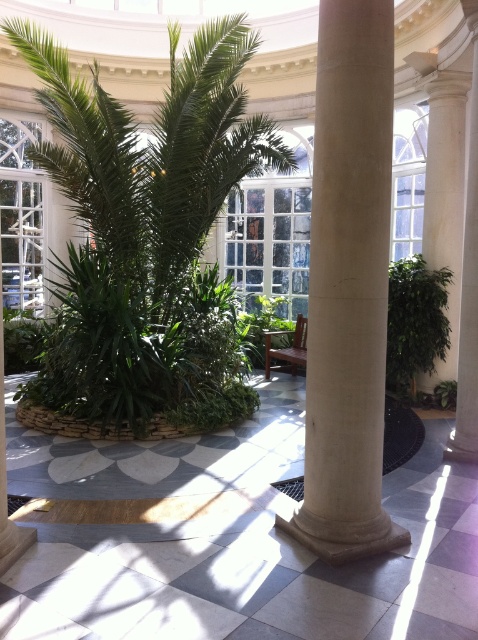
Question: Which point appears closest to the camera in this image?

Choices:
 (A) (452, 280)
 (B) (235, 92)

Answer: (B)

Question: Can you confirm if white marble column at center is positioned to the right of green leafy plant at right?

Choices:
 (A) no
 (B) yes

Answer: (A)

Question: Is green leafy palm tree at center to the left of green leafy plant at right from the viewer's perspective?

Choices:
 (A) yes
 (B) no

Answer: (A)

Question: Is white marble column at center positioned before green leafy plant at right?

Choices:
 (A) yes
 (B) no

Answer: (A)

Question: Which point is closer to the camera?

Choices:
 (A) (389, 273)
 (B) (313, 284)
 (C) (229, 108)

Answer: (B)

Question: Which point is farther to the camera?

Choices:
 (A) (136, 307)
 (B) (355, 396)

Answer: (A)